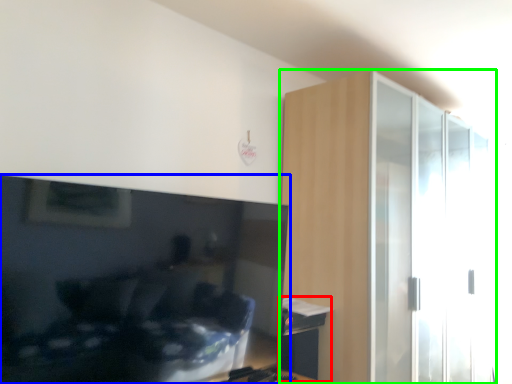
Question: Which object is positioned farthest from table (highlighted by a red box)? Select from television (highlighted by a blue box) and dresser (highlighted by a green box).

Choices:
 (A) television
 (B) dresser

Answer: (B)